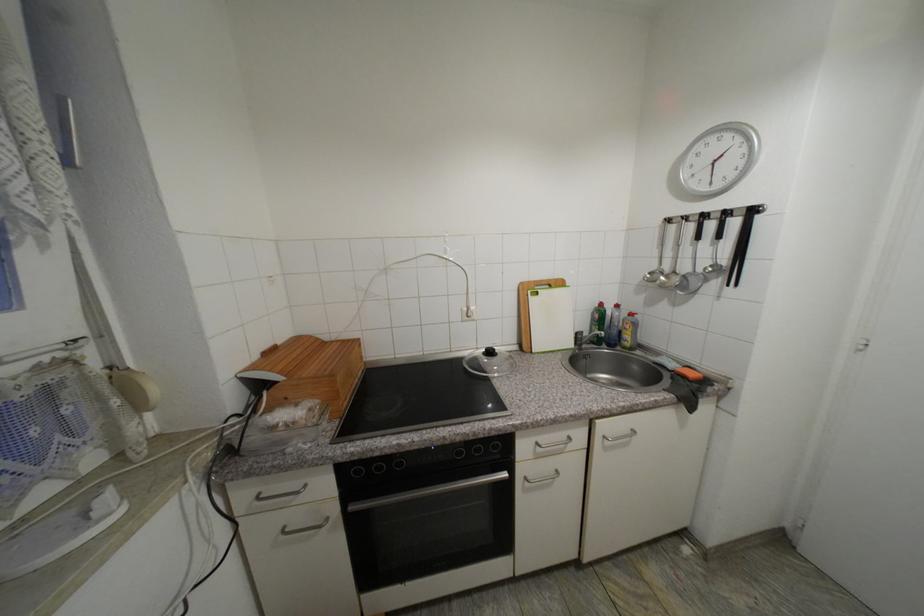
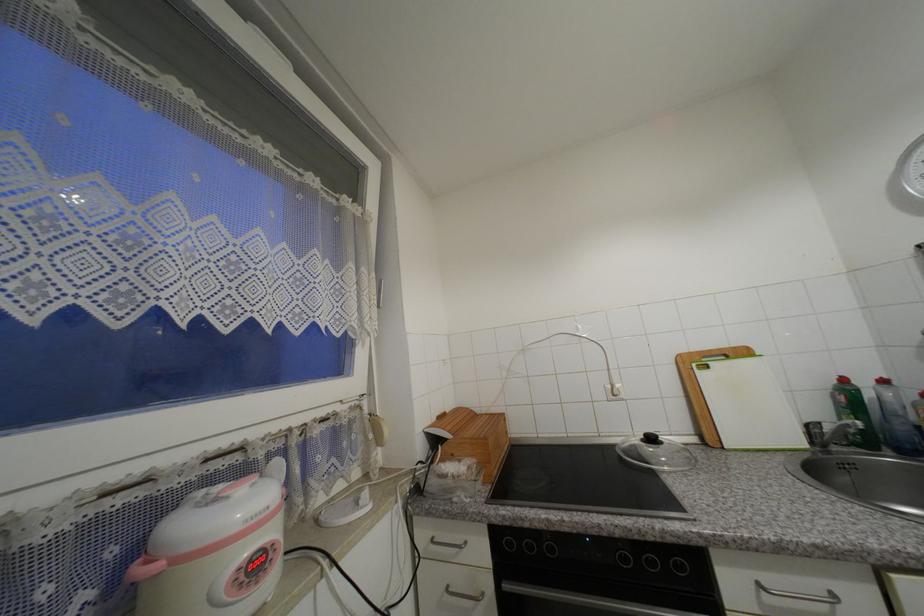
In the second image, find the point that corresponds to (x=582, y=334) in the first image.

(812, 428)